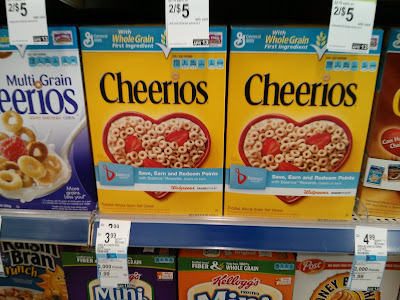
Find the location of a particular element. The height and width of the screenshot is (300, 400). box of cereal is located at coordinates (36, 91), (135, 80), (278, 91), (389, 129), (32, 269), (148, 283), (218, 277), (309, 277).